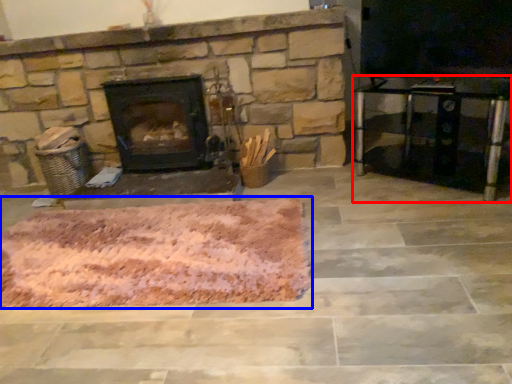
Question: Which object is closer to the camera taking this photo, entertainment center (highlighted by a red box) or mat (highlighted by a blue box)?

Choices:
 (A) entertainment center
 (B) mat

Answer: (B)